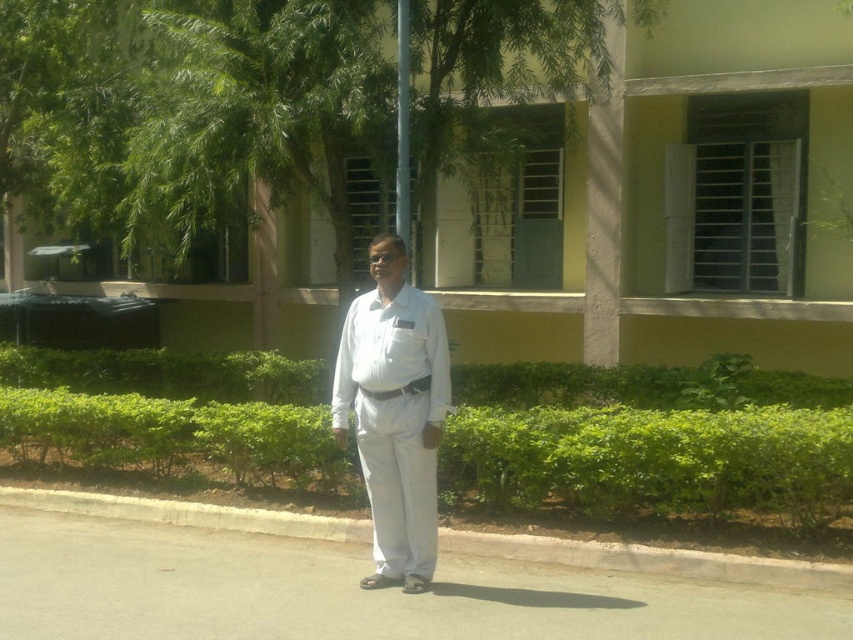
Where is the white cotton shirt at center located in the image?

The white cotton shirt at center is located at point 0.647 in the x coordinate and 0.463 in the y coordinate.

You are a delivery person trying to park your bike near the gray concrete curb at lower center. However, there is a green leafy hedge at center blocking your path. Can you move around the hedge to reach the curb?

The green leafy hedge at center is further to the viewer than the gray concrete curb at lower center, meaning the hedge is between you and the curb. Therefore, you can move around the hedge to reach the gray concrete curb at lower center since it is closer to you.